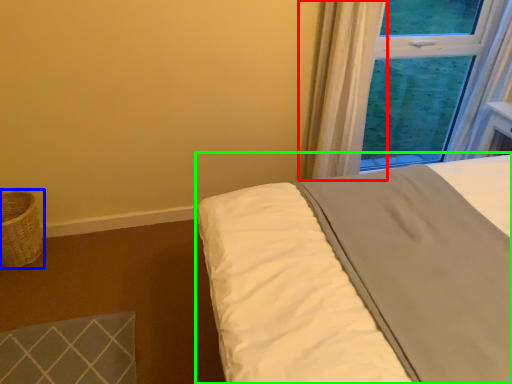
Question: Estimate the real-world distances between objects in this image. Which object is farther from curtain (highlighted by a red box), basket (highlighted by a blue box) or bed (highlighted by a green box)?

Choices:
 (A) basket
 (B) bed

Answer: (A)